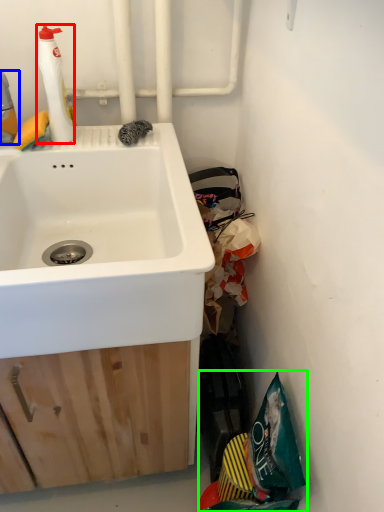
Question: Which object is positioned farthest from cleaning product (highlighted by a red box)? Select from cleaning product (highlighted by a blue box) and garbage (highlighted by a green box).

Choices:
 (A) cleaning product
 (B) garbage

Answer: (B)